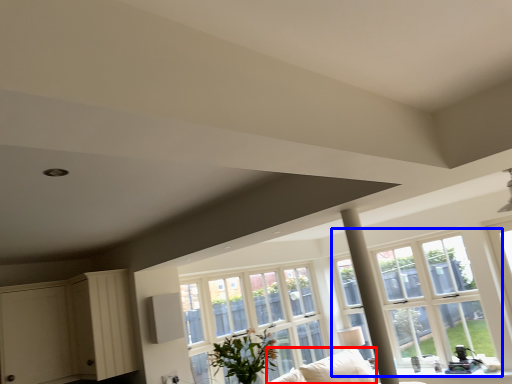
Question: Which object is closer to the camera taking this photo, couch (highlighted by a red box) or window (highlighted by a blue box)?

Choices:
 (A) couch
 (B) window

Answer: (A)